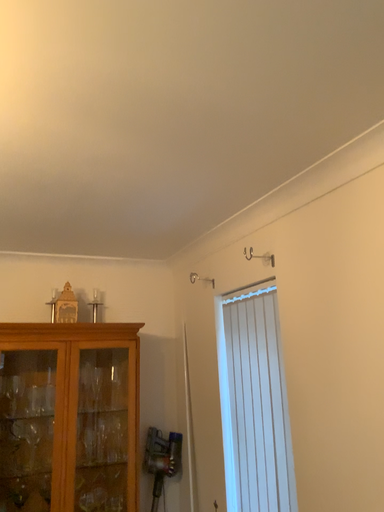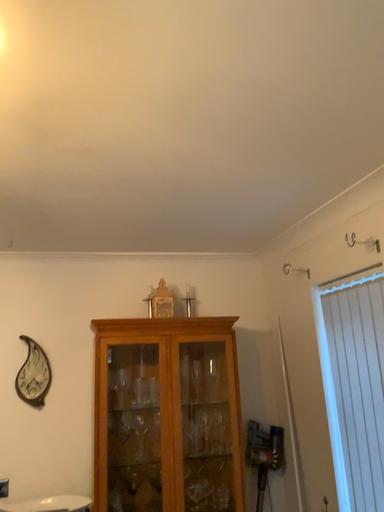
Question: How did the camera likely rotate when shooting the video?

Choices:
 (A) rotated left
 (B) rotated right

Answer: (A)